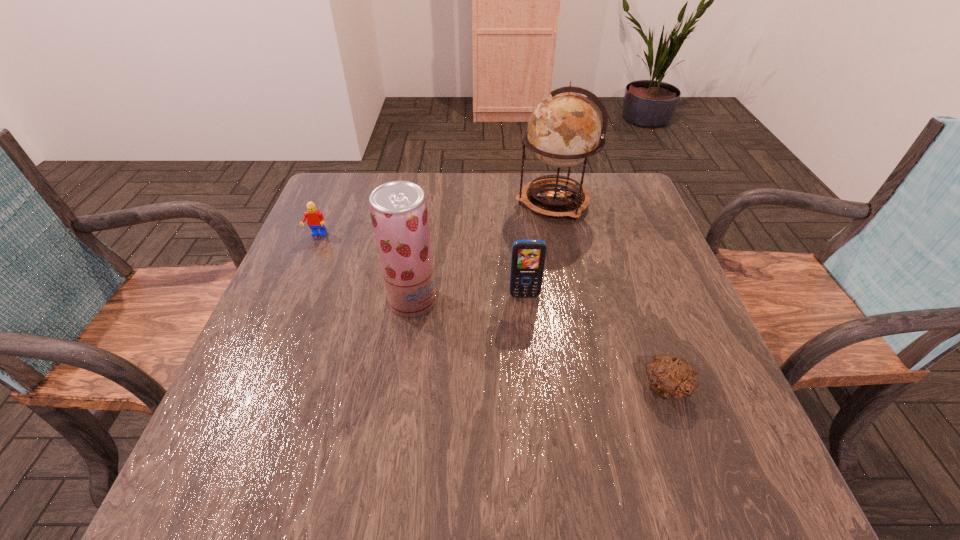
Identify the location of free point between the third tallest object and the fourth object from right to left. The width and height of the screenshot is (960, 540). (468, 299).

Image resolution: width=960 pixels, height=540 pixels. In order to click on vacant space that is in between the fruit juice and the third shortest object in this screenshot , I will do `click(468, 299)`.

Find the location of `free point between the fruit juice and the cellular telephone`. free point between the fruit juice and the cellular telephone is located at coordinates (468, 299).

Image resolution: width=960 pixels, height=540 pixels. Find the location of `free space between the shortest object and the leftmost object`. free space between the shortest object and the leftmost object is located at coordinates (492, 312).

Locate an element on the screen. This screenshot has height=540, width=960. blank region between the second farthest object and the globe is located at coordinates (435, 219).

Identify the location of the second closest object to the globe. This screenshot has width=960, height=540. (399, 213).

Locate an element on the screen. the second closest object to the second farthest object is located at coordinates (564, 129).

At what (x,y) coordinates should I click in order to perform the action: click on vacant space that satisfies the following two spatial constraints: 1. at the center of the globe; 2. on the front-facing side of the second farthest object. Please return your answer as a coordinate pair (x, y). The width and height of the screenshot is (960, 540). Looking at the image, I should click on (560, 235).

This screenshot has width=960, height=540. Identify the location of free space in the image that satisfies the following two spatial constraints: 1. on the front-facing side of the fruit juice; 2. on the left side of the second farthest object. (290, 301).

Where is `vacant space that satisfies the following two spatial constraints: 1. at the center of the farthest object; 2. on the screen of the cellular telephone`? vacant space that satisfies the following two spatial constraints: 1. at the center of the farthest object; 2. on the screen of the cellular telephone is located at coordinates (572, 296).